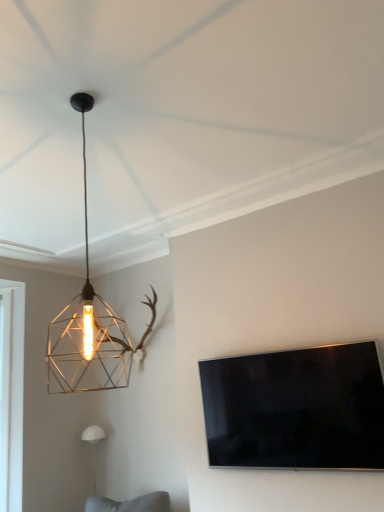
Question: Can you confirm if flat-screen tv at right is taller than metallic wire cage at upper left, the second lamp positioned from the back?

Choices:
 (A) no
 (B) yes

Answer: (A)

Question: Considering the relative positions of flat-screen tv at right and metallic wire cage at upper left, positioned as the 1th lamp in right-to-left order, in the image provided, is flat-screen tv at right to the left of metallic wire cage at upper left, positioned as the 1th lamp in right-to-left order, from the viewer's perspective?

Choices:
 (A) no
 (B) yes

Answer: (A)

Question: From the image's perspective, is flat-screen tv at right under metallic wire cage at upper left, which is the first lamp from front to back?

Choices:
 (A) yes
 (B) no

Answer: (A)

Question: Could you tell me if flat-screen tv at right is facing metallic wire cage at upper left, arranged as the 2th lamp when ordered from the bottom?

Choices:
 (A) yes
 (B) no

Answer: (A)

Question: Is flat-screen tv at right positioned far away from metallic wire cage at upper left, acting as the 2th lamp starting from the left?

Choices:
 (A) yes
 (B) no

Answer: (A)

Question: Is flat-screen tv at right wider or thinner than metallic wire cage at upper left, the second lamp positioned from the back?

Choices:
 (A) wide
 (B) thin

Answer: (B)

Question: From the image's perspective, is flat-screen tv at right positioned above or below metallic wire cage at upper left, positioned as the 1th lamp in right-to-left order?

Choices:
 (A) above
 (B) below

Answer: (B)

Question: Visually, is flat-screen tv at right positioned to the left or to the right of metallic wire cage at upper left, arranged as the 2th lamp when ordered from the bottom?

Choices:
 (A) left
 (B) right

Answer: (B)

Question: Relative to metallic wire cage at upper left, acting as the 2th lamp starting from the left, is flat-screen tv at right in front or behind?

Choices:
 (A) behind
 (B) front

Answer: (A)

Question: From the image's perspective, relative to metallic wire cage at upper left, acting as the 2th lamp starting from the left, is white matte wall sconce at lower left, the second lamp viewed from the front, above or below?

Choices:
 (A) above
 (B) below

Answer: (B)

Question: Looking at the image, does white matte wall sconce at lower left, the first lamp in the back-to-front sequence, seem bigger or smaller compared to metallic wire cage at upper left, positioned as the 1th lamp in right-to-left order?

Choices:
 (A) small
 (B) big

Answer: (A)

Question: Choose the correct answer: Is white matte wall sconce at lower left, which is the first lamp from bottom to top, inside metallic wire cage at upper left, acting as the 2th lamp starting from the left, or outside it?

Choices:
 (A) outside
 (B) inside

Answer: (A)

Question: Looking at their shapes, would you say white matte wall sconce at lower left, which is the first lamp from bottom to top, is wider or thinner than metallic wire cage at upper left, acting as the 2th lamp starting from the left?

Choices:
 (A) thin
 (B) wide

Answer: (A)

Question: Does point (89, 359) appear closer or farther from the camera than point (89, 434)?

Choices:
 (A) farther
 (B) closer

Answer: (A)

Question: Is metallic wire cage at upper left, positioned as the 1th lamp in right-to-left order, taller or shorter than white matte wall sconce at lower left, positioned as the 2th lamp in right-to-left order?

Choices:
 (A) short
 (B) tall

Answer: (B)